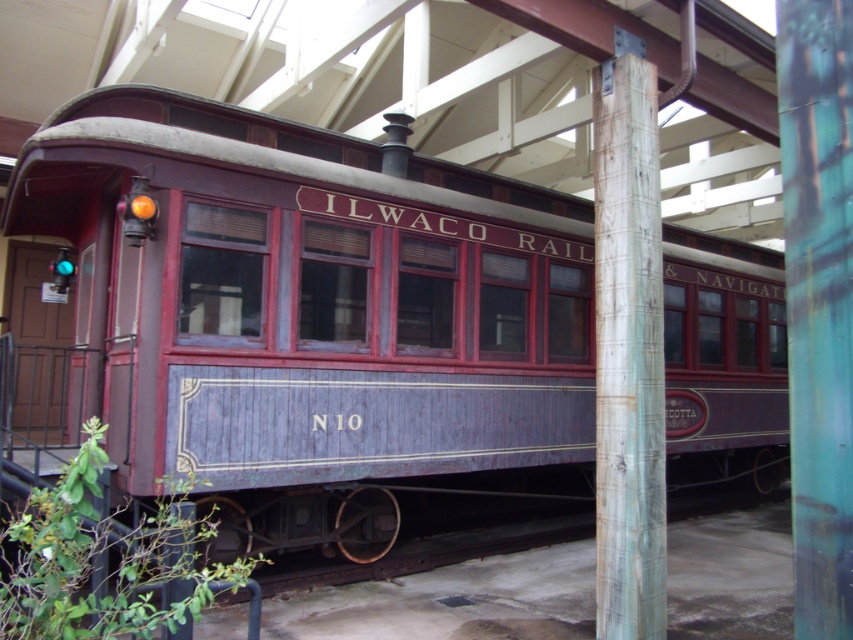
Question: Considering the relative positions of matte wood train car at center and wooden post at center in the image provided, where is matte wood train car at center located with respect to wooden post at center?

Choices:
 (A) above
 (B) below

Answer: (A)

Question: Observing the image, what is the correct spatial positioning of matte wood train car at center in reference to wooden post at center?

Choices:
 (A) below
 (B) above

Answer: (B)

Question: Is matte wood train car at center below wooden post at center?

Choices:
 (A) yes
 (B) no

Answer: (B)

Question: Which point is farther to the camera?

Choices:
 (A) (218, 365)
 (B) (653, 104)

Answer: (A)